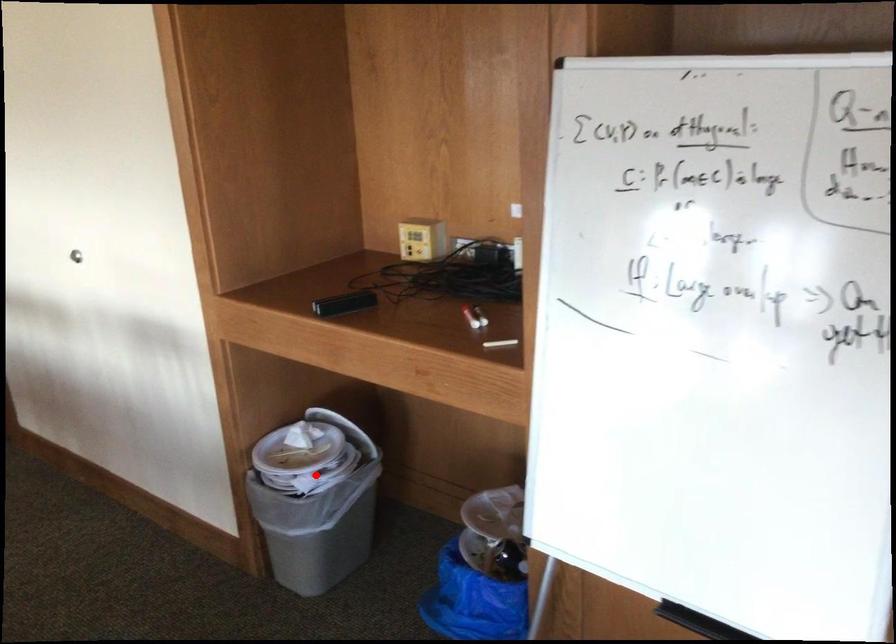
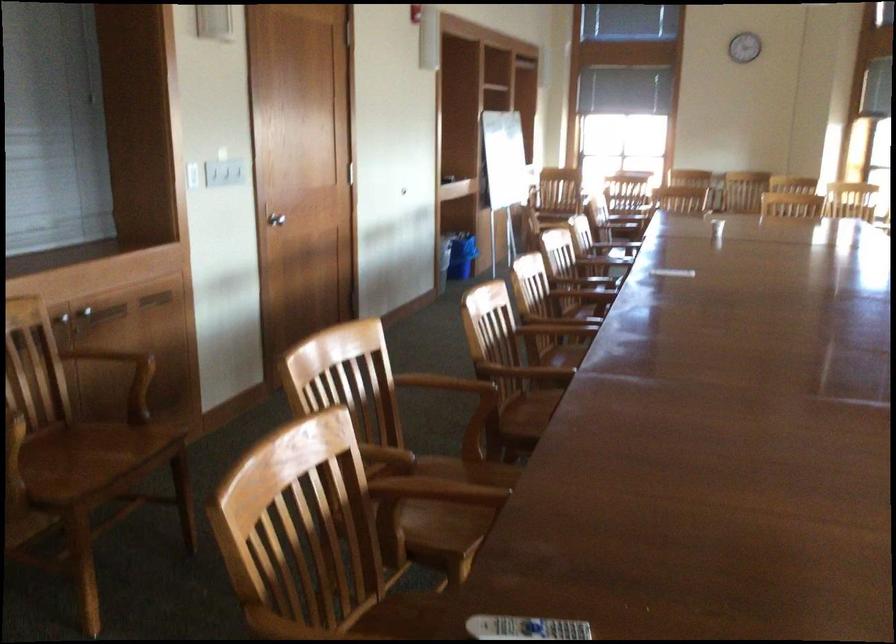
Question: I am providing you with two images of the same scene from different viewpoints. A red point is marked on the first image. At the location where the point appears in image 1, is it still visible in image 2?

Choices:
 (A) Yes
 (B) No

Answer: (B)